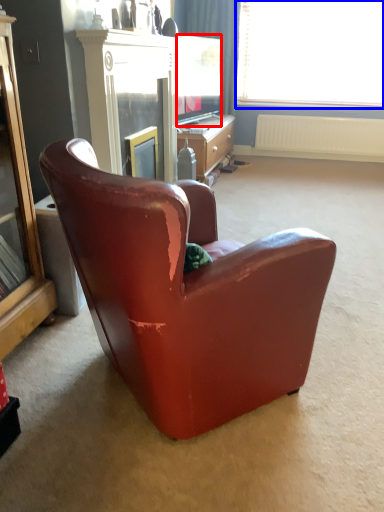
Question: Which object is closer to the camera taking this photo, television (highlighted by a red box) or window (highlighted by a blue box)?

Choices:
 (A) television
 (B) window

Answer: (A)